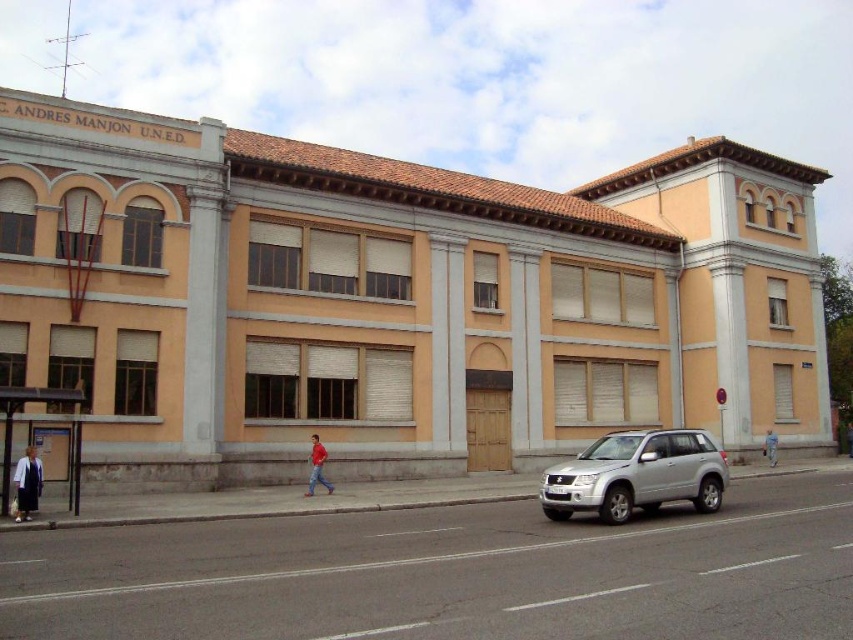
You are a photographer standing in front of the building. You want to take a photo that includes both the silver metallic suv at lower right and the red cotton shirt at center. Which object should you focus on first to ensure both are in frame?

You should focus on the silver metallic suv at lower right first because it is larger than the red cotton shirt at center, so it will occupy more space in the photo and ensure both are visible.

You are standing in front of the building and want to determine the relative positions of two points marked on its facade. Which point is closer to you, the point at coordinate (315, 468) or the point at (764, 445)?

The point at coordinate (315, 468) is closer to the viewer than the point at (764, 445).